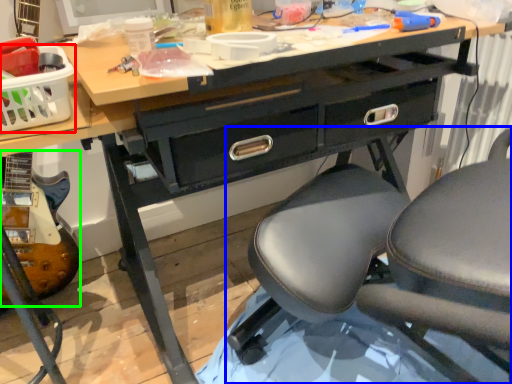
Question: Considering the real-world distances, which object is farthest from basket (highlighted by a red box)? chair (highlighted by a blue box) or equipment (highlighted by a green box)?

Choices:
 (A) chair
 (B) equipment

Answer: (A)